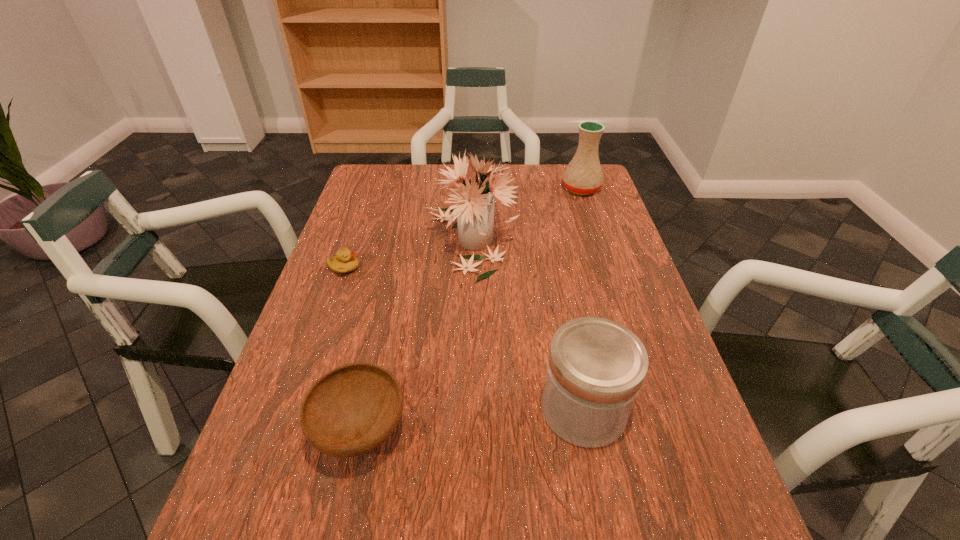
The image size is (960, 540). In order to click on bouquet in this screenshot , I will do `click(473, 207)`.

The image size is (960, 540). In order to click on the farthest object in this screenshot , I will do `click(583, 176)`.

You are a GUI agent. You are given a task and a screenshot of the screen. Output one action in this format:
    pyautogui.click(x=<x>, y=<y>)
    Task: Click on the fourth shortest object
    
    Given the screenshot: What is the action you would take?
    pyautogui.click(x=583, y=176)

Locate an element on the screen. the third tallest object is located at coordinates (596, 367).

At what (x,y) coordinates should I click in order to perform the action: click on the second shortest object. Please return your answer as a coordinate pair (x, y). Looking at the image, I should click on (351, 410).

Find the location of a particular element. This screenshot has width=960, height=540. the leftmost object is located at coordinates (345, 261).

The width and height of the screenshot is (960, 540). In order to click on the shortest object in this screenshot , I will do `click(345, 261)`.

At what (x,y) coordinates should I click in order to perform the action: click on vacant space located on the back of the tallest object. Please return your answer as a coordinate pair (x, y). Looking at the image, I should click on (472, 182).

This screenshot has width=960, height=540. Identify the location of vacant area situated on the front of the farthest object. (600, 245).

Identify the location of blank space located on the back of the jar. (568, 333).